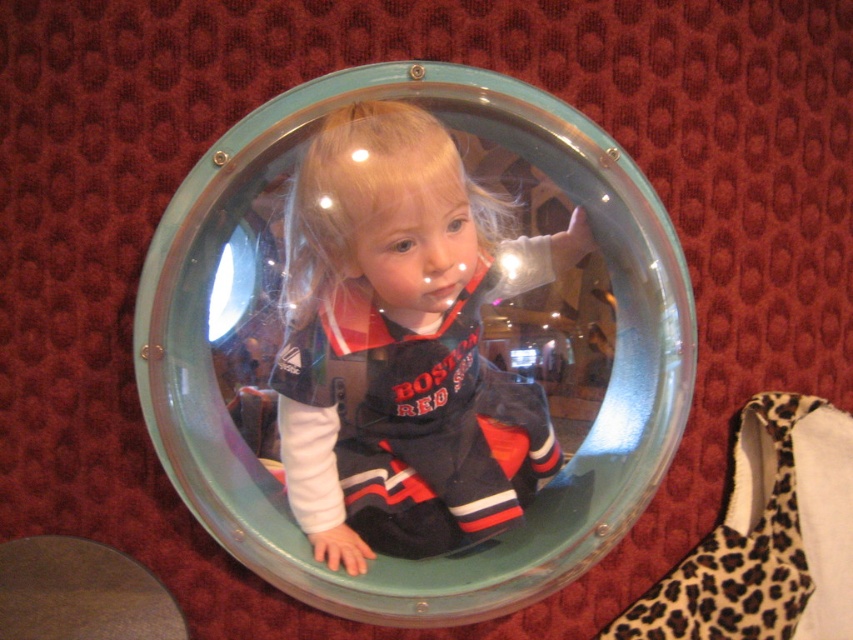
You are an astronaut preparing for a mission and need to check the distance between the transparent plastic dome at center and the matte black astronaut suit at center. According to the exhibit guidelines, the minimum safe distance between the dome and the suit must be at least 4 inches. Is the current distance compliant with the safety standards?

The transparent plastic dome at center is 3.52 inches away from the matte black astronaut suit at center. Since 3.52 inches is less than the required 4 inches, the current distance does not comply with the safety standards.

You are standing in front of the porthole structure in the image. There are two points marked on the wall. The first point is at coordinates point (613, 188) and the second point is at point (299, 420). From your perspective, which point is closer to you?

Point (299, 420) is closer to you because the Objects Description states that point (613, 188) is behind point (299, 420).

You are an astronaut preparing for a mission and need to choose between the transparent plastic dome at center and the matte black astronaut suit at center. Which object is larger and would be more suitable for protecting against space debris?

The transparent plastic dome at center is bigger than the matte black astronaut suit at center, so it would be more suitable for protection against space debris due to its larger size.